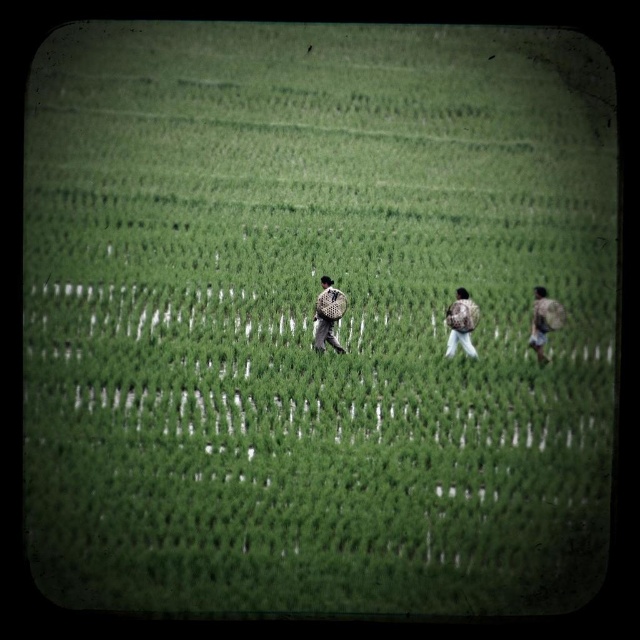
Is camouflage-patterned backpack at center behind camouflage fabric backpack at right?

No.

Is camouflage-patterned backpack at center below camouflage fabric backpack at right?

No, camouflage-patterned backpack at center is not below camouflage fabric backpack at right.

This screenshot has height=640, width=640. I want to click on camouflage-patterned backpack at center, so click(x=326, y=316).

Does camouflage-patterned backpack at center have a lesser width compared to camouflage backpack at center?

Incorrect, camouflage-patterned backpack at center's width is not less than camouflage backpack at center's.

Where is `camouflage-patterned backpack at center`? camouflage-patterned backpack at center is located at coordinates (326, 316).

Is point (541, 353) farther from viewer compared to point (458, 324)?

Yes.

Does camouflage fabric backpack at right appear on the right side of camouflage backpack at center?

Indeed, camouflage fabric backpack at right is positioned on the right side of camouflage backpack at center.

From the picture: Who is more distant from viewer, (544, 310) or (467, 296)?

The point (467, 296) is behind.

You are a GUI agent. You are given a task and a screenshot of the screen. Output one action in this format:
    pyautogui.click(x=<x>, y=<y>)
    Task: Click on the camouflage fabric backpack at right
    The height and width of the screenshot is (640, 640).
    Given the screenshot: What is the action you would take?
    pyautogui.click(x=544, y=321)